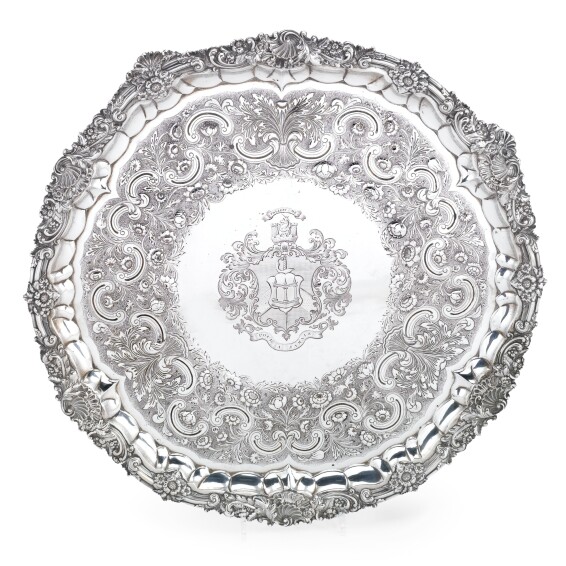
This screenshot has width=566, height=566. In order to click on three candles in this screenshot , I will do `click(284, 294)`, `click(293, 293)`, `click(275, 291)`.